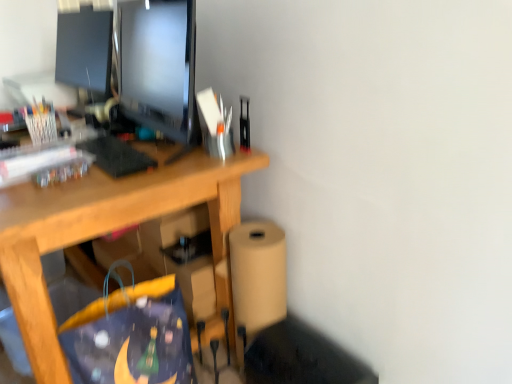
Question: Is blue fabric shopping bag at lower center surrounding translucent plastic pen holder at upper left, the first stationery positioned from the left?

Choices:
 (A) no
 (B) yes

Answer: (A)

Question: From the image's perspective, is blue fabric shopping bag at lower center over translucent plastic pen holder at upper left, which appears as the second stationery when viewed from the right?

Choices:
 (A) no
 (B) yes

Answer: (A)

Question: From a real-world perspective, is blue fabric shopping bag at lower center physically above translucent plastic pen holder at upper left, the 1th stationery positioned from the back?

Choices:
 (A) no
 (B) yes

Answer: (A)

Question: Considering the relative positions of blue fabric shopping bag at lower center and translucent plastic pen holder at upper left, which appears as the second stationery when viewed from the right, in the image provided, is blue fabric shopping bag at lower center behind translucent plastic pen holder at upper left, which appears as the second stationery when viewed from the right,?

Choices:
 (A) no
 (B) yes

Answer: (A)

Question: Considering the relative positions of blue fabric shopping bag at lower center and translucent plastic pen holder at upper left, the first stationery positioned from the left, in the image provided, is blue fabric shopping bag at lower center in front of translucent plastic pen holder at upper left, the first stationery positioned from the left,?

Choices:
 (A) no
 (B) yes

Answer: (B)

Question: From the image's perspective, would you say blue fabric shopping bag at lower center is shown under translucent plastic pen holder at upper left, which appears as the second stationery when viewed from the right?

Choices:
 (A) no
 (B) yes

Answer: (B)

Question: Considering the relative positions of translucent plastic pen holder at upper left, which is the 2th stationery from front to back, and blue fabric shopping bag at lower center in the image provided, is translucent plastic pen holder at upper left, which is the 2th stationery from front to back, to the left of blue fabric shopping bag at lower center from the viewer's perspective?

Choices:
 (A) no
 (B) yes

Answer: (B)

Question: Is there a large distance between translucent plastic pen holder at upper left, which is the 2th stationery from front to back, and blue fabric shopping bag at lower center?

Choices:
 (A) yes
 (B) no

Answer: (B)

Question: Does translucent plastic pen holder at upper left, which appears as the second stationery when viewed from the right, appear on the right side of blue fabric shopping bag at lower center?

Choices:
 (A) no
 (B) yes

Answer: (A)

Question: Is translucent plastic pen holder at upper left, the 1th stationery positioned from the back, oriented away from blue fabric shopping bag at lower center?

Choices:
 (A) no
 (B) yes

Answer: (A)

Question: Does translucent plastic pen holder at upper left, which appears as the second stationery when viewed from the right, have a lesser width compared to blue fabric shopping bag at lower center?

Choices:
 (A) yes
 (B) no

Answer: (A)

Question: Is blue fabric shopping bag at lower center located within translucent plastic pen holder at upper left, the 1th stationery positioned from the back?

Choices:
 (A) no
 (B) yes

Answer: (A)

Question: From a real-world perspective, is metallic silver stapler at upper right, positioned as the second stationery in back-to-front order, positioned under matte black monitor at upper left based on gravity?

Choices:
 (A) no
 (B) yes

Answer: (B)